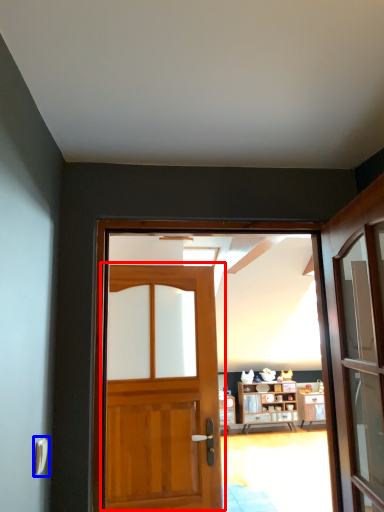
Question: Among these objects, which one is farthest to the camera, door (highlighted by a red box) or door handle (highlighted by a blue box)?

Choices:
 (A) door
 (B) door handle

Answer: (A)